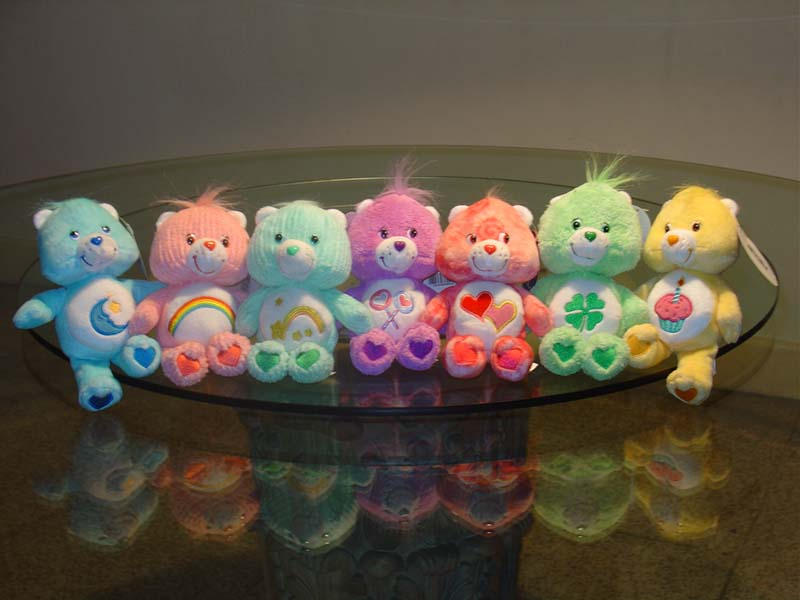
This screenshot has height=600, width=800. I want to click on yellow stuffed bear, so click(681, 205).